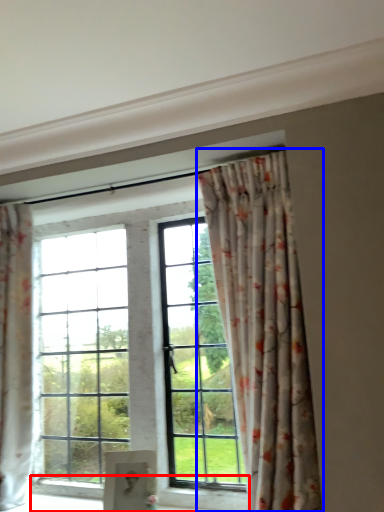
Question: Which of the following is the closest to the observer, window sill (highlighted by a red box) or curtain (highlighted by a blue box)?

Choices:
 (A) window sill
 (B) curtain

Answer: (B)